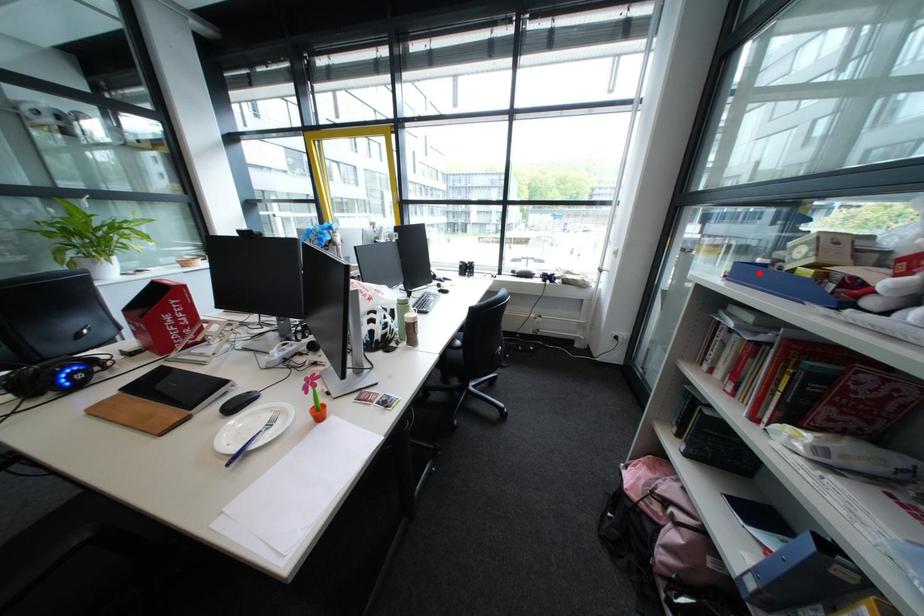
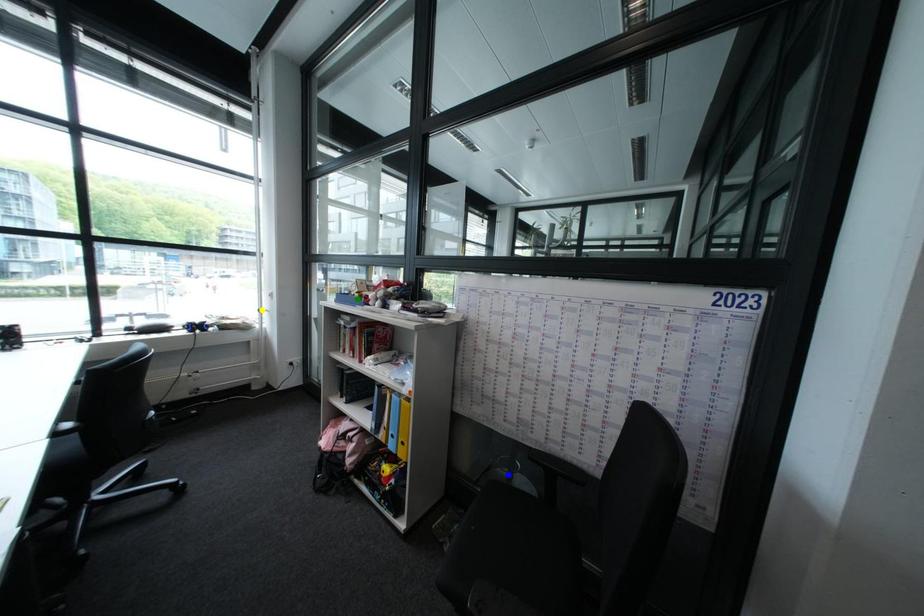
Question: I am providing you with two images of the same scene from different viewpoints. A red point is marked on the first image. You are given multiple points on the second image. Which mark in image 2 goes with the point in image 1?

Choices:
 (A) blue point
 (B) yellow point
 (C) green point

Answer: (C)